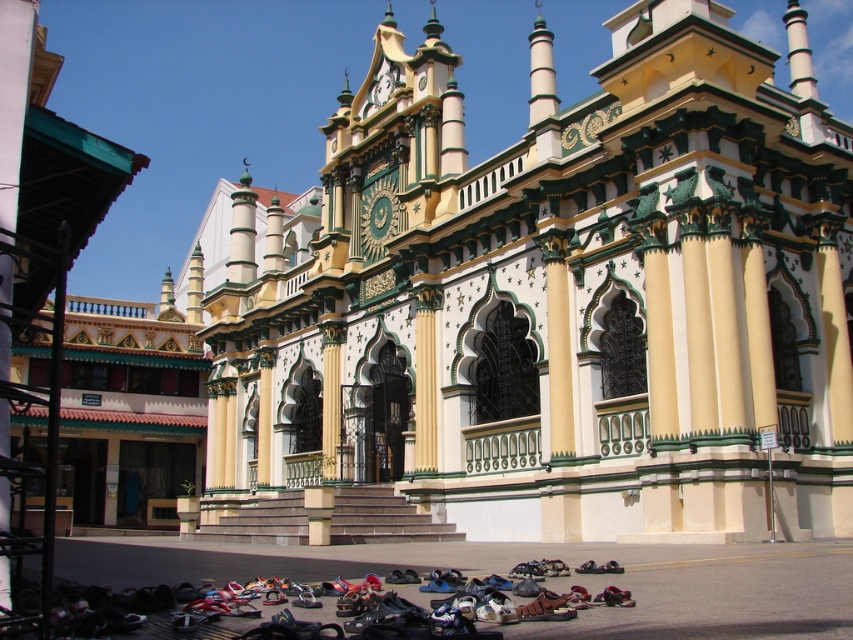
You are standing at the bottom of the wide stone steps leading to the yellow painted stone palace at center. You notice leather sandals at lower center placed on the ground nearby. If you want to walk towards the entrance, which object would you need to step over or around first?

You would need to step over or around the leather sandals at lower center first because they are closer to your current position at the bottom of the steps compared to the yellow painted stone palace at center, which is further away on the upper part of the steps.